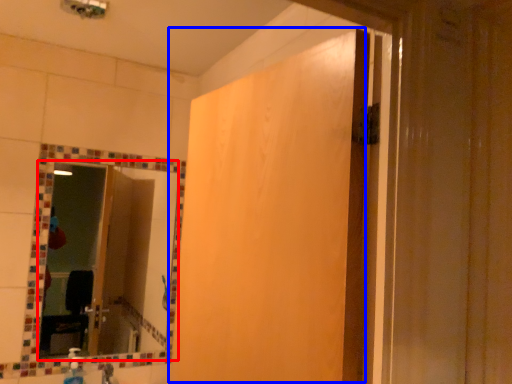
Question: Which object appears closest to the camera in this image, mirror (highlighted by a red box) or screen door (highlighted by a blue box)?

Choices:
 (A) mirror
 (B) screen door

Answer: (B)